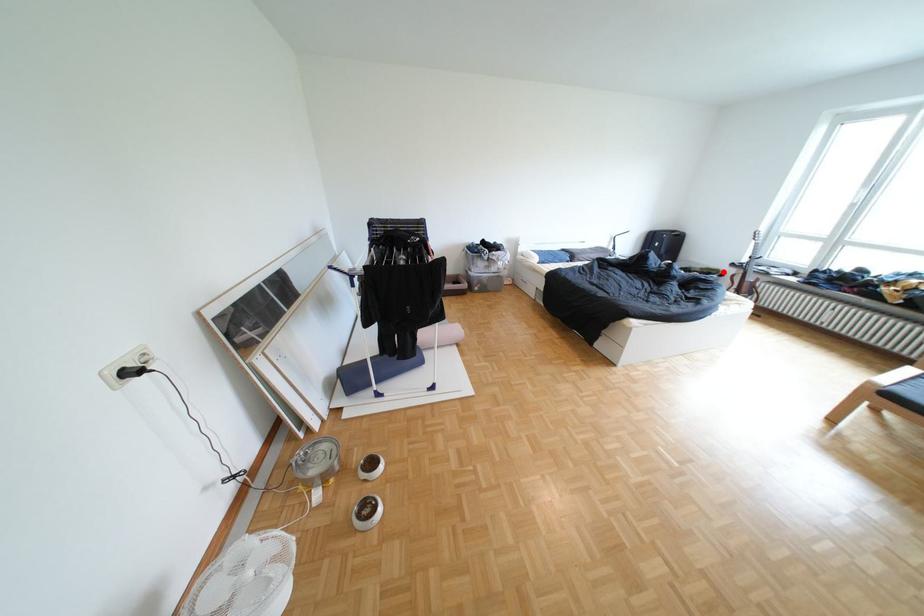
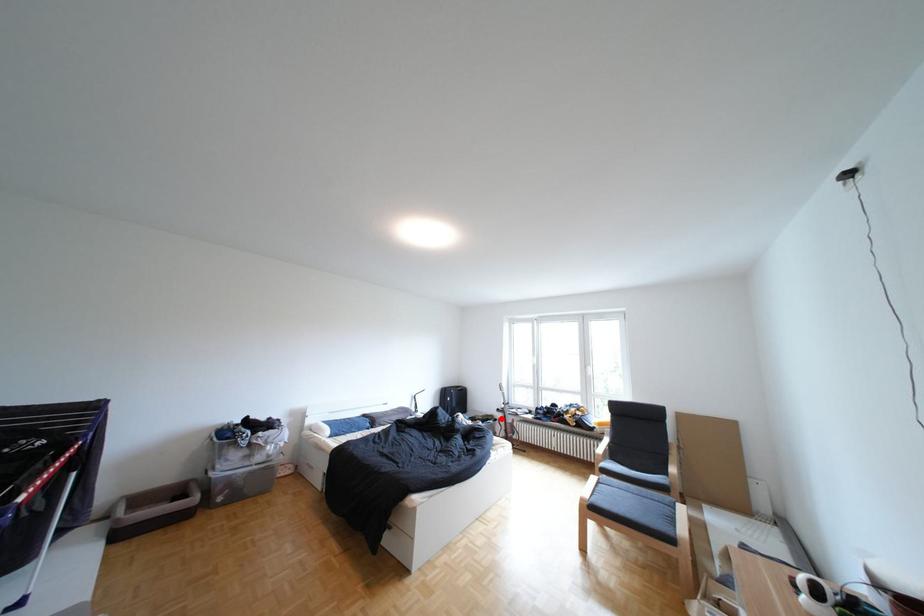
I am providing you with two images of the same scene from different viewpoints. A red point is marked on the first image and another point is marked on the second image. Does the point marked in image1 correspond to the same location as the one in image2?

Yes